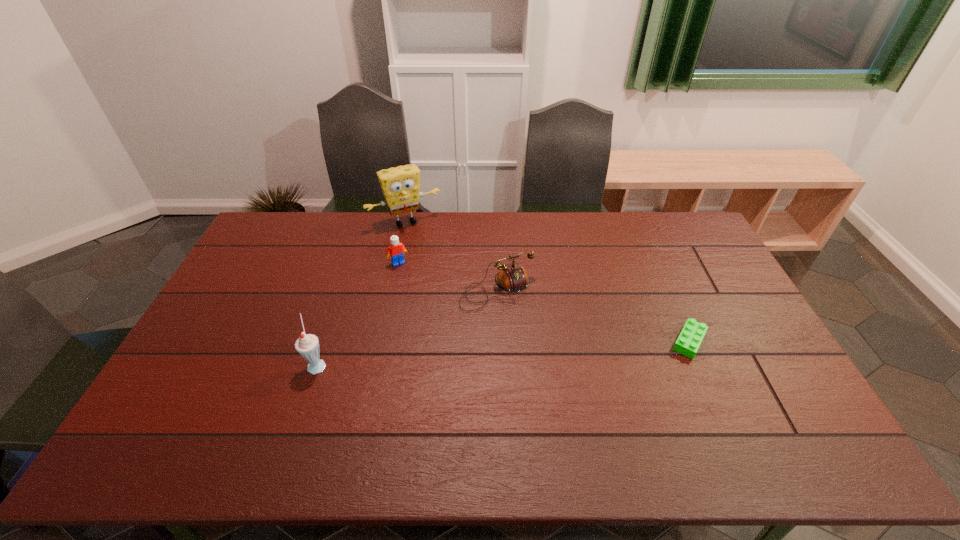
At what (x,y) coordinates should I click in order to perform the action: click on object at the far edge. Please return your answer as a coordinate pair (x, y). The width and height of the screenshot is (960, 540). Looking at the image, I should click on (401, 186).

Locate an element on the screen. The height and width of the screenshot is (540, 960). object present at the right edge is located at coordinates coord(692,334).

In the image, there is a desktop. Where is `vacant space at the far edge`? vacant space at the far edge is located at coordinates (571, 220).

Find the location of a particular element. This screenshot has width=960, height=540. free location at the near edge is located at coordinates (514, 417).

You are a GUI agent. You are given a task and a screenshot of the screen. Output one action in this format:
    pyautogui.click(x=<x>, y=<y>)
    Task: Click on the free location at the left edge
    The height and width of the screenshot is (540, 960).
    Given the screenshot: What is the action you would take?
    pyautogui.click(x=261, y=278)

The width and height of the screenshot is (960, 540). Find the location of `vacant space at the far right corner of the desktop`. vacant space at the far right corner of the desktop is located at coordinates (676, 222).

The width and height of the screenshot is (960, 540). In order to click on free space at the near right corner of the desktop in this screenshot , I will do `click(796, 406)`.

You are a GUI agent. You are given a task and a screenshot of the screen. Output one action in this format:
    pyautogui.click(x=<x>, y=<y>)
    Task: Click on the empty space between the telephone and the shortest object
    
    Given the screenshot: What is the action you would take?
    coord(593,315)

At what (x,y) coordinates should I click in order to perform the action: click on unoccupied position between the taller Lego and the second tallest object. Please return your answer as a coordinate pair (x, y). Looking at the image, I should click on (358, 313).

Find the location of a particular element. Image resolution: width=960 pixels, height=540 pixels. vacant space in between the milkshake and the third farthest object is located at coordinates (407, 327).